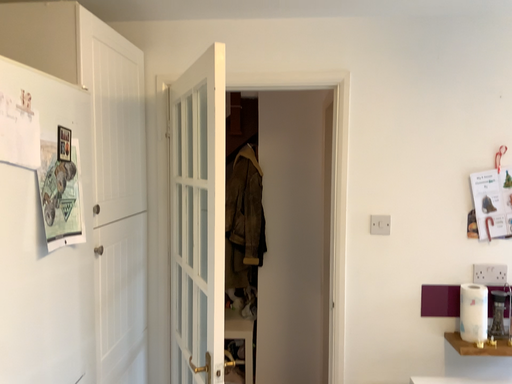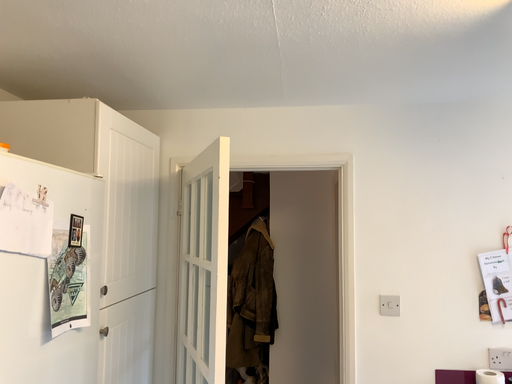
Question: Which way did the camera rotate in the video?

Choices:
 (A) rotated downward
 (B) rotated upward

Answer: (B)